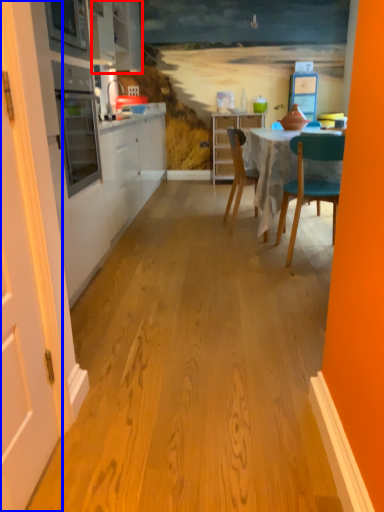
Question: Among these objects, which one is nearest to the camera, cabinetry (highlighted by a red box) or door (highlighted by a blue box)?

Choices:
 (A) cabinetry
 (B) door

Answer: (B)